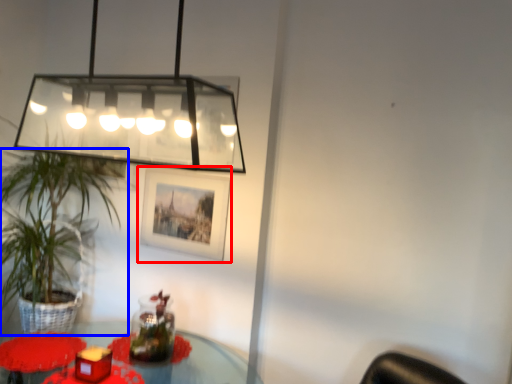
Question: Which object appears farthest to the camera in this image, picture frame (highlighted by a red box) or houseplant (highlighted by a blue box)?

Choices:
 (A) picture frame
 (B) houseplant

Answer: (A)